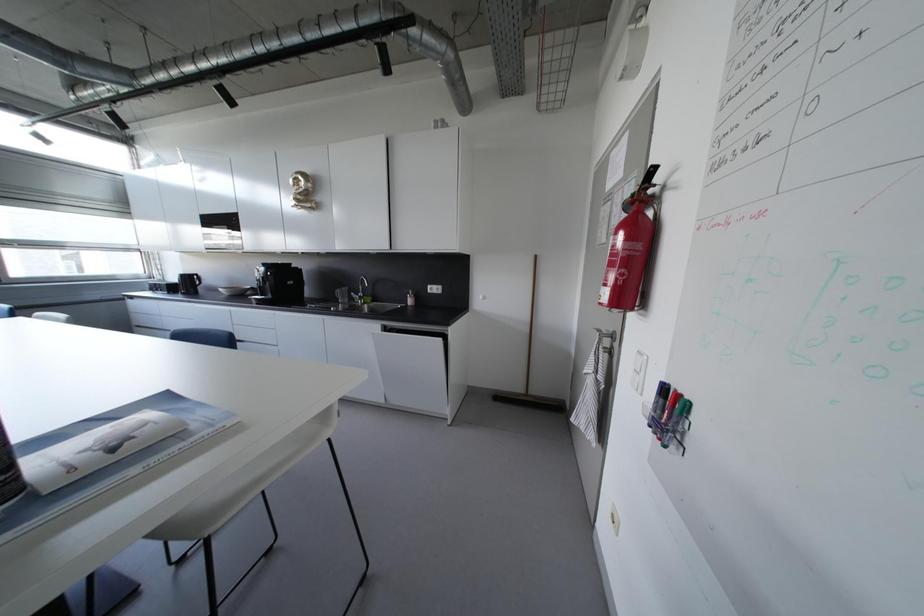
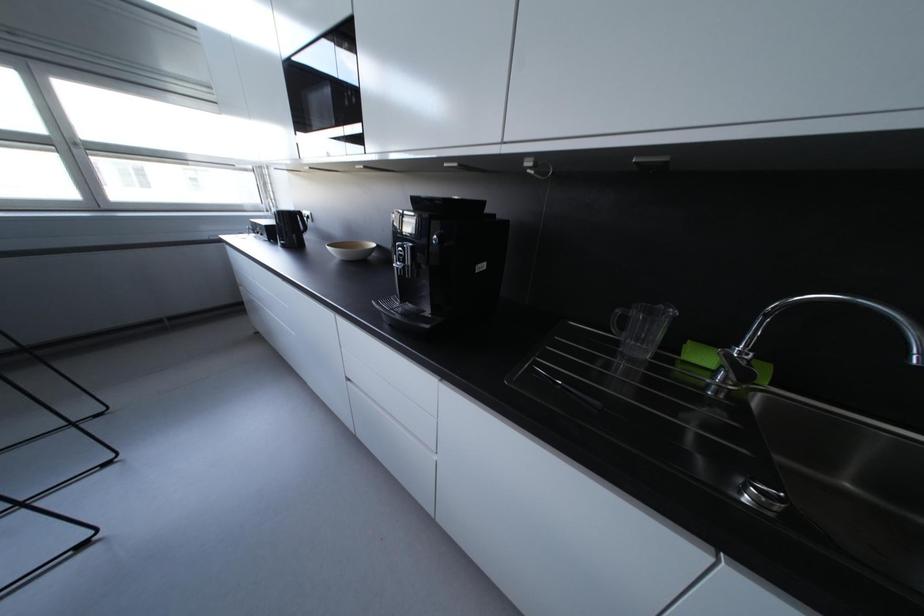
What movement of the cameraman would produce the second image?

The cameraman moved toward left, forward.